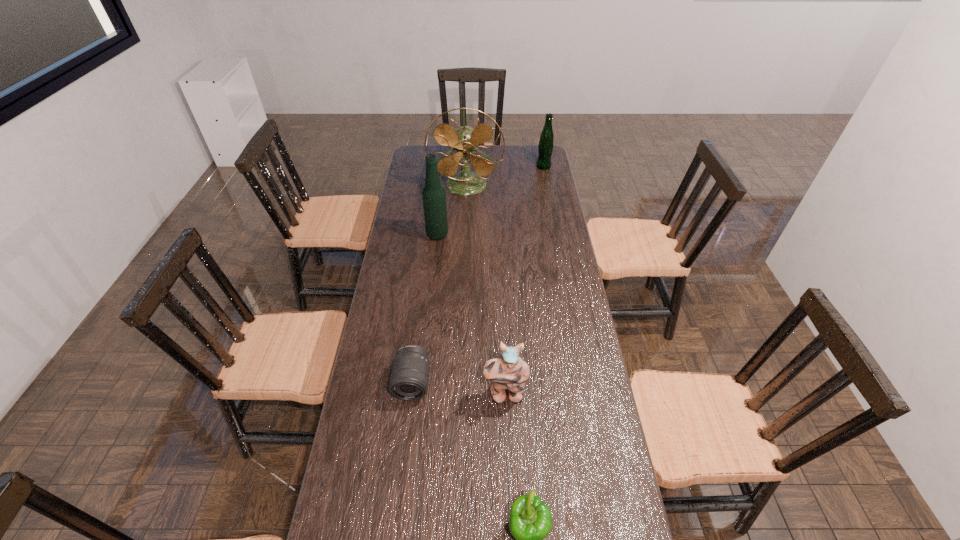
Select which object appears as the third closest to the second farthest object. Please provide its 2D coordinates. Your answer should be formatted as a tuple, i.e. [(x, y)], where the tuple contains the x and y coordinates of a point satisfying the conditions above.

[(409, 377)]

At what (x,y) coordinates should I click in order to perform the action: click on object that is the second closest to the fifth nearest object. Please return your answer as a coordinate pair (x, y). The image size is (960, 540). Looking at the image, I should click on (434, 196).